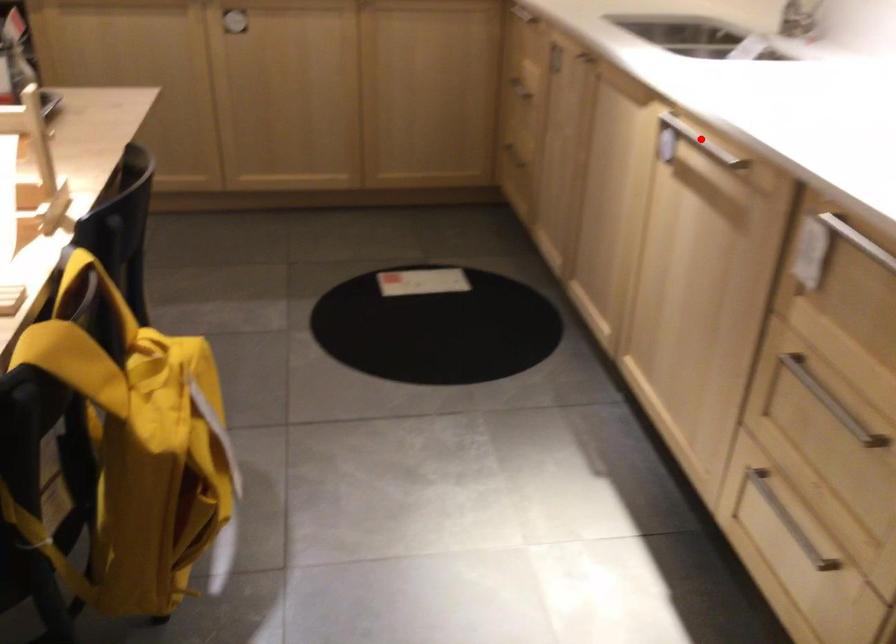
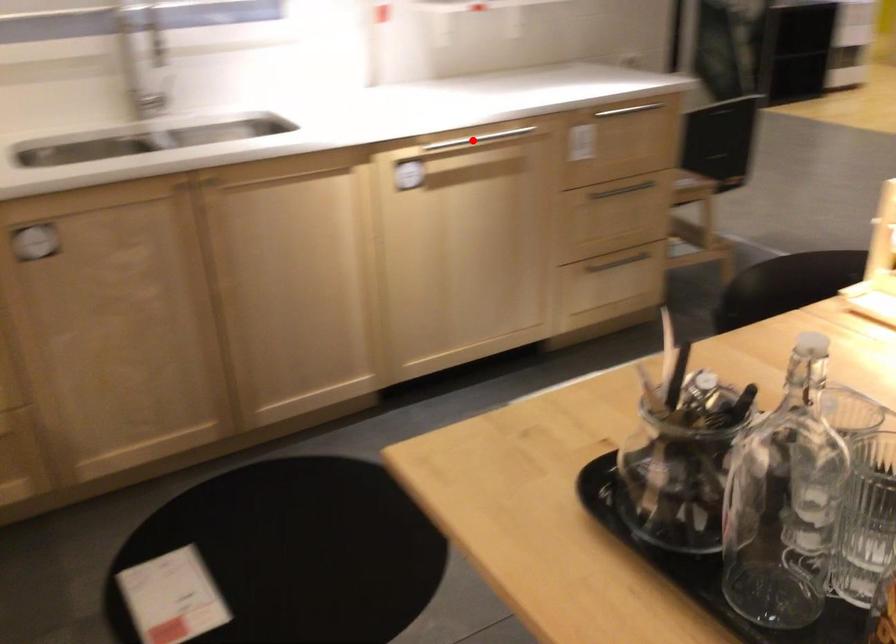
I am providing you with two images of the same scene from different viewpoints. A red point is marked on the first image and another point is marked on the second image. Does the point marked in image1 correspond to the same location as the one in image2?

Yes